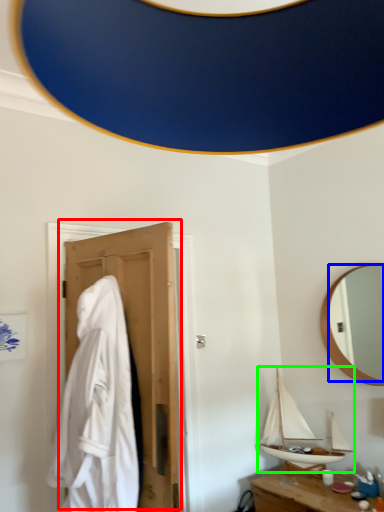
Question: Estimate the real-world distances between objects in this image. Which object is closer to door (highlighted by a red box), mirror (highlighted by a blue box) or boat (highlighted by a green box)?

Choices:
 (A) mirror
 (B) boat

Answer: (B)